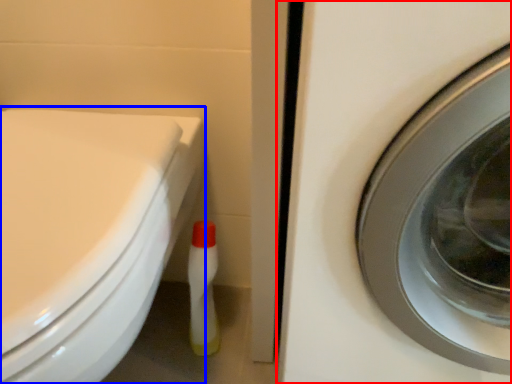
Question: Which of the following is the closest to the observer, washing machine (highlighted by a red box) or bidet (highlighted by a blue box)?

Choices:
 (A) washing machine
 (B) bidet

Answer: (A)